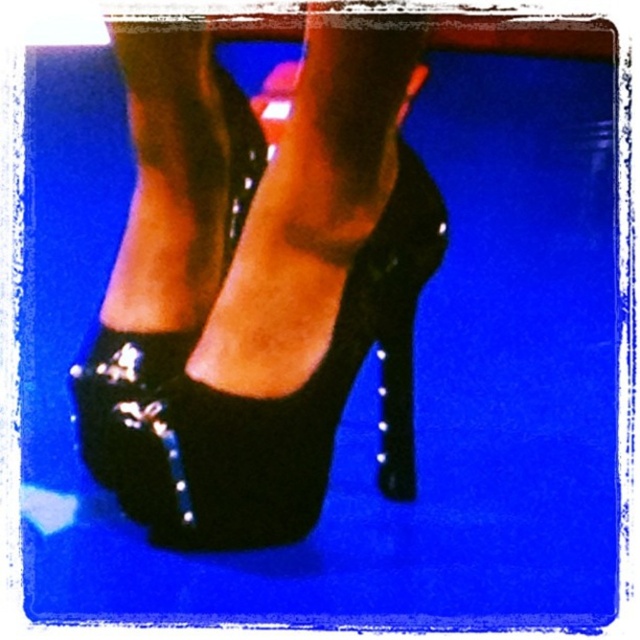
Question: Where is shiny black high heels at center located in relation to shiny black high-heeled shoe at center in the image?

Choices:
 (A) above
 (B) below

Answer: (A)

Question: Which point is farther from the camera taking this photo?

Choices:
 (A) (104, 323)
 (B) (333, 44)

Answer: (A)

Question: Does shiny black high heels at center come in front of shiny black high-heeled shoe at center?

Choices:
 (A) no
 (B) yes

Answer: (B)

Question: Observing the image, what is the correct spatial positioning of shiny black high heels at center in reference to shiny black high-heeled shoe at center?

Choices:
 (A) above
 (B) below

Answer: (A)

Question: Which object appears farthest from the camera in this image?

Choices:
 (A) shiny black high heels at center
 (B) shiny black high-heeled shoe at center

Answer: (B)